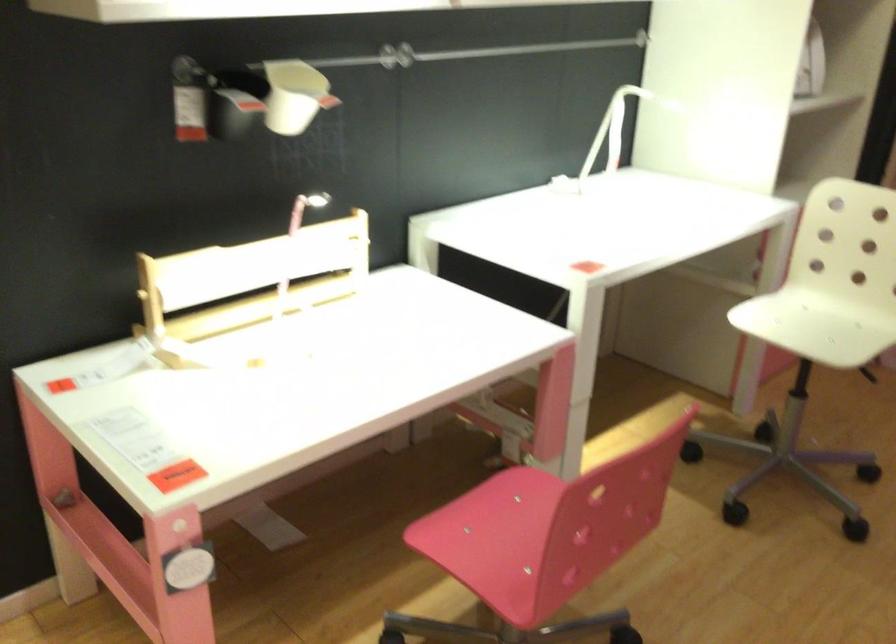
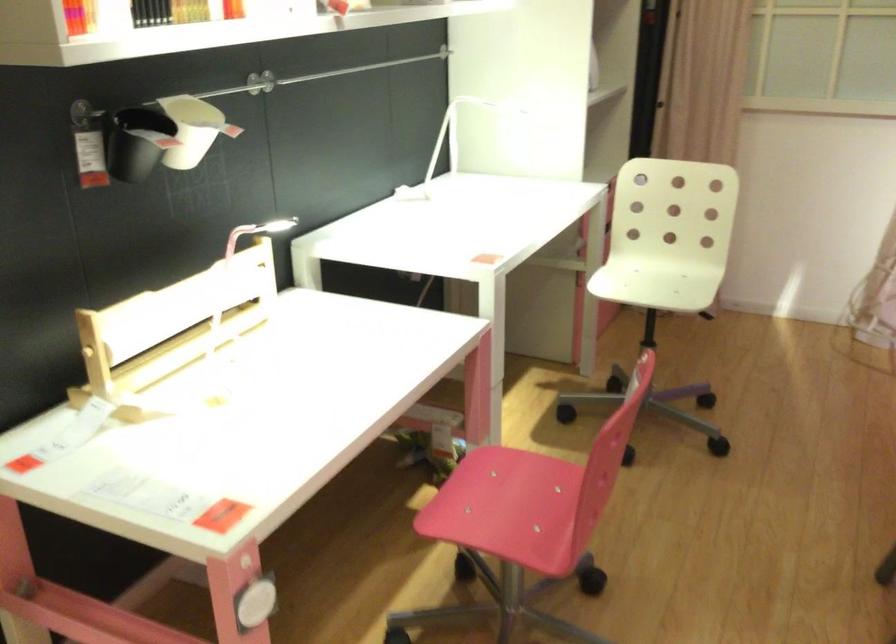
Question: The images are taken continuously from a first-person perspective. In which direction are you moving?

Choices:
 (A) Left
 (B) Right
 (C) Forward
 (D) Backward

Answer: (A)